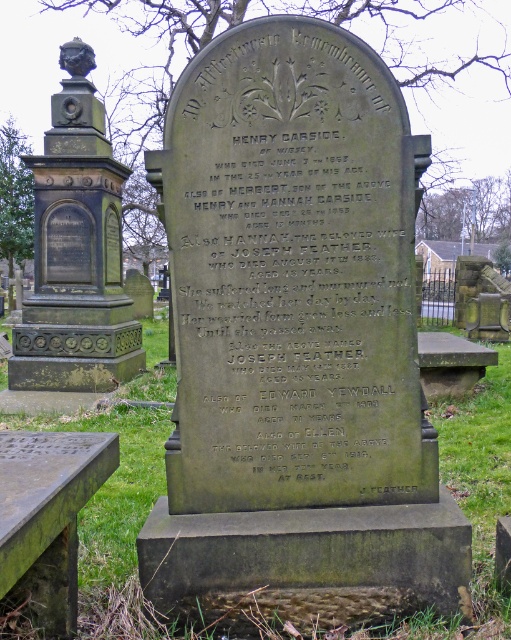
Between dark gray stone inscription at center and dark gray stone monument at center, which one has less height?

With less height is dark gray stone inscription at center.

Can you confirm if dark gray stone inscription at center is wider than dark gray stone monument at center?

In fact, dark gray stone inscription at center might be narrower than dark gray stone monument at center.

What do you see at coordinates (293, 310) in the screenshot? This screenshot has width=511, height=640. I see `dark gray stone inscription at center` at bounding box center [293, 310].

Find the location of `dark gray stone inscription at center`. dark gray stone inscription at center is located at coordinates (293, 310).

Does dark gray stone tombstone at center have a greater width compared to dark gray stone monument at center?

In fact, dark gray stone tombstone at center might be narrower than dark gray stone monument at center.

Between dark gray stone tombstone at center and dark gray stone monument at center, which one appears on the right side from the viewer's perspective?

Positioned to the right is dark gray stone tombstone at center.

Between point (181, 451) and point (81, 131), which one is positioned in front?

Positioned in front is point (181, 451).

At what (x,y) coordinates should I click in order to perform the action: click on dark gray stone tombstone at center. Please return your answer as a coordinate pair (x, y). Looking at the image, I should click on (295, 342).

This screenshot has width=511, height=640. I want to click on dark gray stone tombstone at center, so click(295, 342).

Which of these two, dark gray stone tombstone at center or dark gray stone inscription at center, stands taller?

dark gray stone tombstone at center is taller.

I want to click on dark gray stone tombstone at center, so click(295, 342).